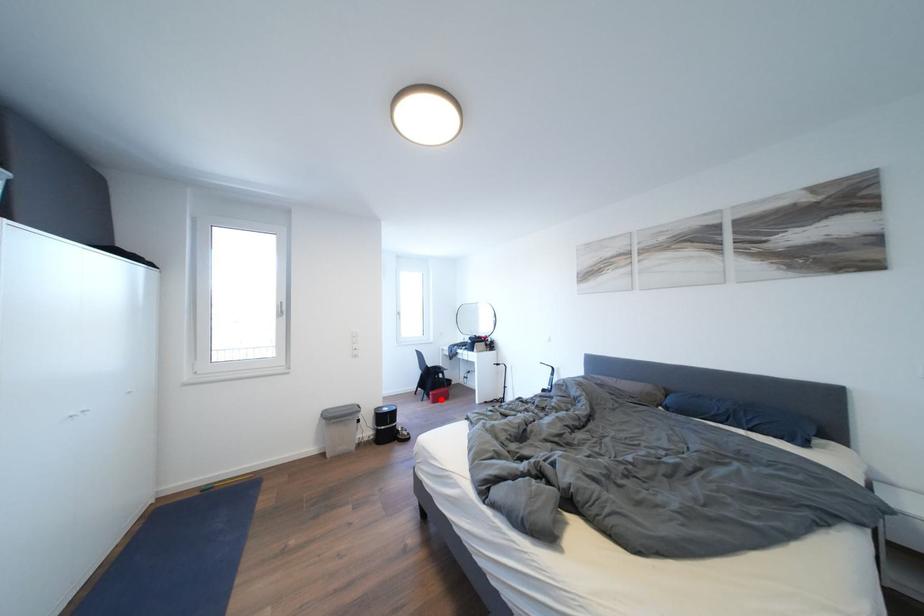
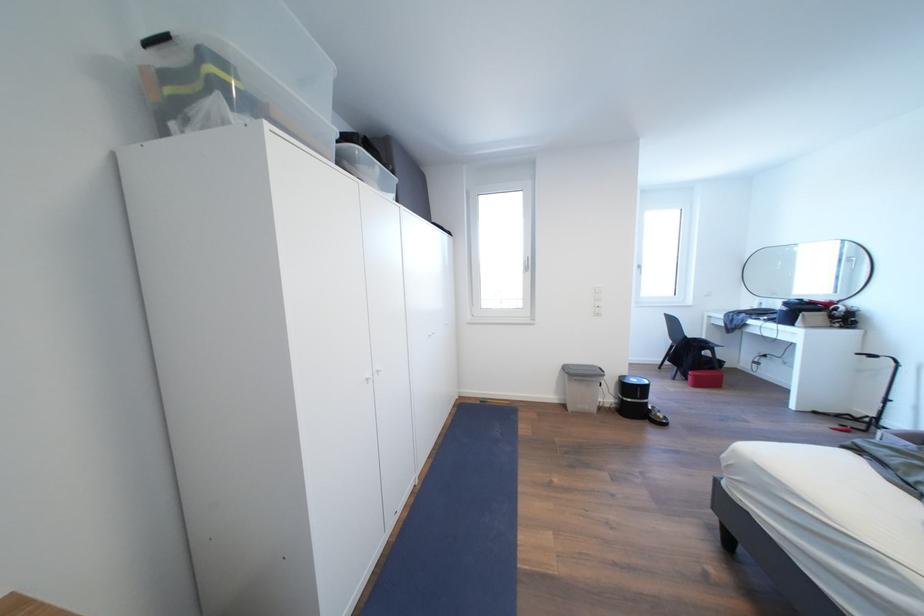
Locate, in the second image, the point that corresponds to the highlighted location in the first image.

(703, 381)